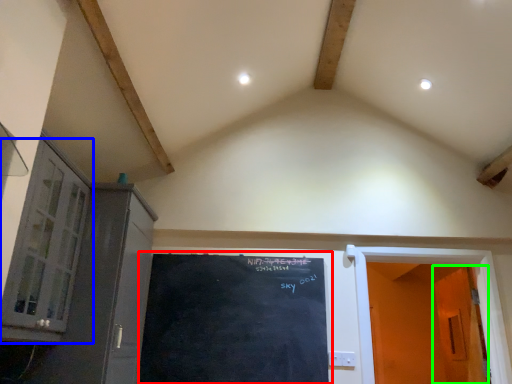
Question: Considering the real-world distances, which object is closest to bulletin board (highlighted by a red box)? window (highlighted by a blue box) or door (highlighted by a green box).

Choices:
 (A) window
 (B) door

Answer: (A)